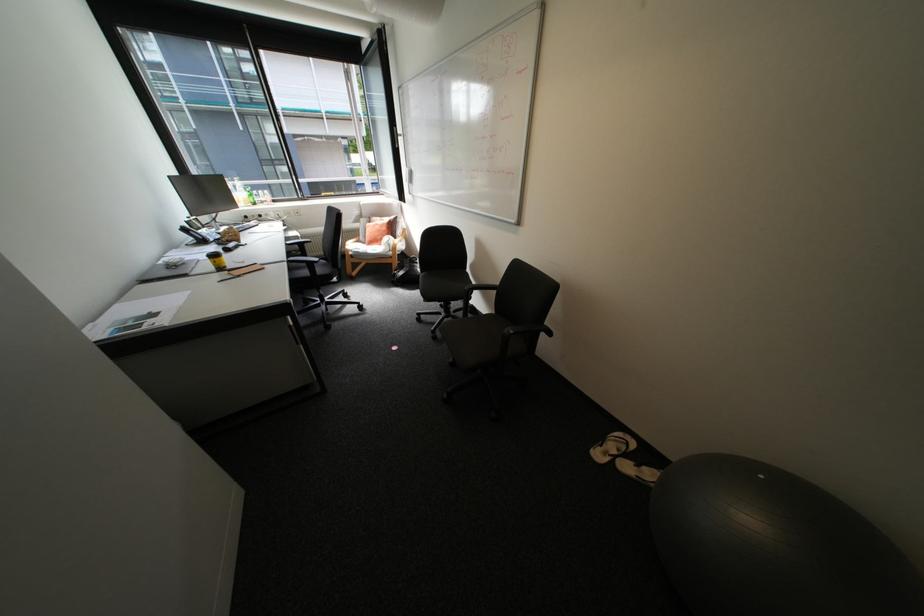
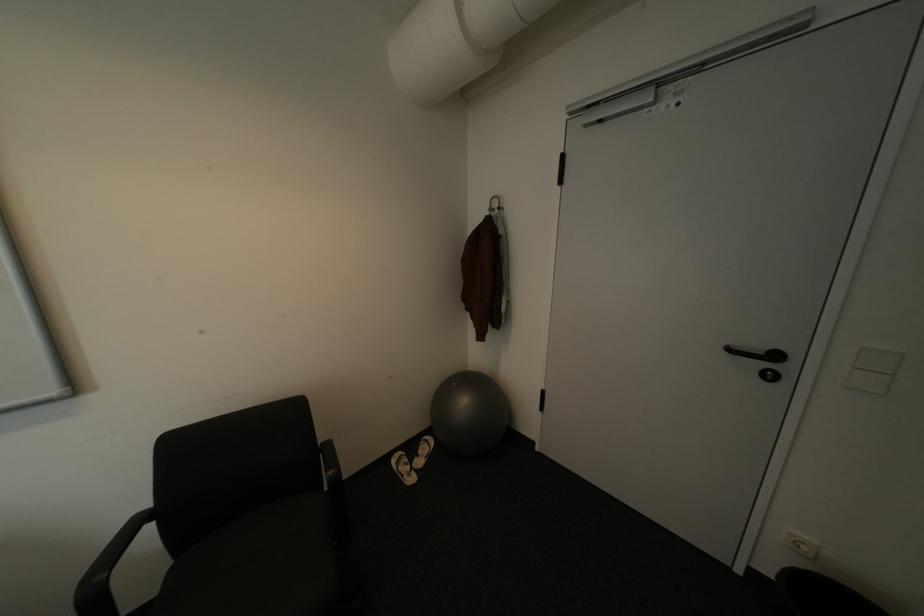
The point at (x=772, y=477) is marked in the first image. Where is the corresponding point in the second image?

(464, 384)